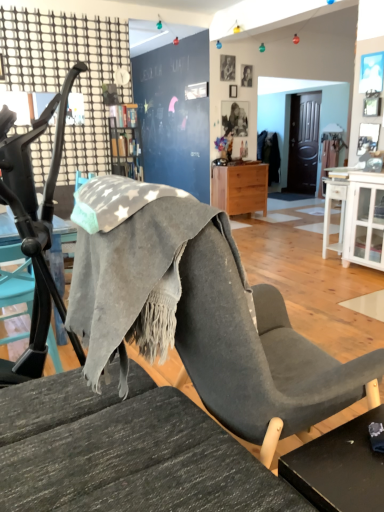
Question: Is the depth of light wood/texture nightstand at center greater than that of gray fabric chair at left?

Choices:
 (A) no
 (B) yes

Answer: (B)

Question: Does light wood/texture nightstand at center appear on the left side of gray fabric chair at left?

Choices:
 (A) no
 (B) yes

Answer: (A)

Question: Is gray fabric chair at left inside light wood/texture nightstand at center?

Choices:
 (A) yes
 (B) no

Answer: (B)

Question: Is light wood/texture nightstand at center taller than gray fabric chair at left?

Choices:
 (A) yes
 (B) no

Answer: (B)

Question: From the image's perspective, is light wood/texture nightstand at center located beneath gray fabric chair at left?

Choices:
 (A) yes
 (B) no

Answer: (B)

Question: Choose the correct answer: Is gray fabric chair at left inside smooth skin portrait at upper center, placed as the second person when sorted from front to back, or outside it?

Choices:
 (A) inside
 (B) outside

Answer: (B)

Question: From the image's perspective, relative to smooth skin portrait at upper center, placed as the second person when sorted from front to back, is gray fabric chair at left above or below?

Choices:
 (A) below
 (B) above

Answer: (A)

Question: Does point (18, 225) appear closer or farther from the camera than point (244, 80)?

Choices:
 (A) closer
 (B) farther

Answer: (A)

Question: Considering their positions, is gray fabric chair at left located in front of or behind smooth skin portrait at upper center, placed as the second person when sorted from front to back?

Choices:
 (A) front
 (B) behind

Answer: (A)

Question: Would you say wooden bookshelf at upper center is inside or outside smooth skin portrait at upper center, which is counted as the first person, starting from the right?

Choices:
 (A) inside
 (B) outside

Answer: (B)

Question: In the image, is wooden bookshelf at upper center positioned in front of or behind smooth skin portrait at upper center, the second person viewed from the left?

Choices:
 (A) behind
 (B) front

Answer: (B)

Question: Does point (122, 146) appear closer or farther from the camera than point (246, 72)?

Choices:
 (A) closer
 (B) farther

Answer: (A)

Question: From a real-world perspective, relative to smooth skin portrait at upper center, the 1th person viewed from the back, is wooden bookshelf at upper center vertically above or below?

Choices:
 (A) above
 (B) below

Answer: (B)

Question: Relative to white glossy cabinet at right, is black matte table at lower right in front or behind?

Choices:
 (A) behind
 (B) front

Answer: (B)

Question: From the image's perspective, is black matte table at lower right positioned above or below white glossy cabinet at right?

Choices:
 (A) below
 (B) above

Answer: (A)